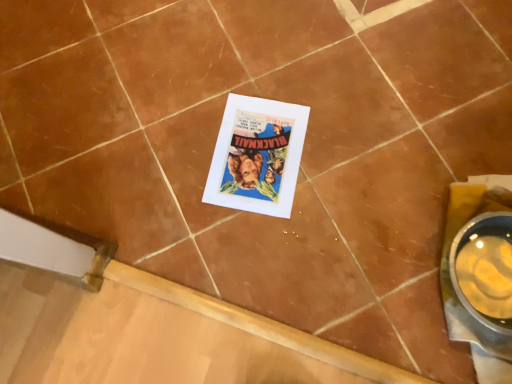
Where is `vacant point above matte paper poster at center (from a real-world perspective)`? vacant point above matte paper poster at center (from a real-world perspective) is located at coordinates (254, 147).